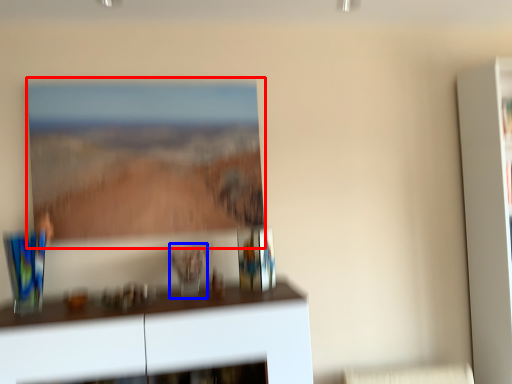
Question: Which object is closer to the camera taking this photo, picture frame (highlighted by a red box) or glass vase (highlighted by a blue box)?

Choices:
 (A) picture frame
 (B) glass vase

Answer: (B)